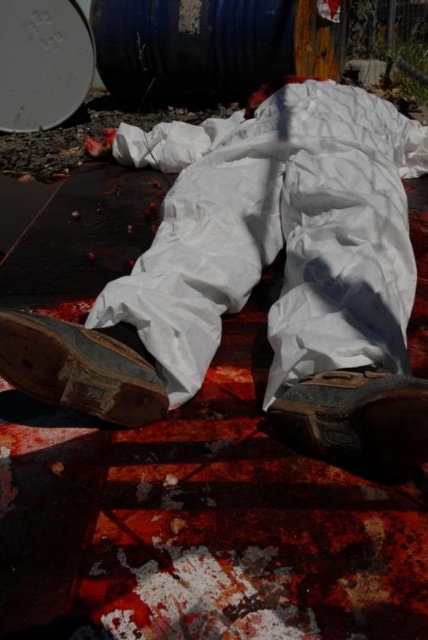
You are a rescue worker assessing the scene. You see the white matte suit at center and the blue metallic barrel at upper center. Which object is nearer to you?

The white matte suit at center is closer to the viewer than the blue metallic barrel at upper center.

You are a rescue worker trying to reach the brown suede shoe at lower center to check for injuries. The white matte suit at center is blocking your path. Can you safely move the suit to access the shoe without getting too close?

The white matte suit at center is 11.15 inches away from the brown suede shoe at lower center. Since the distance is sufficient, you can carefully move the suit to access the shoe without needing to get too close.